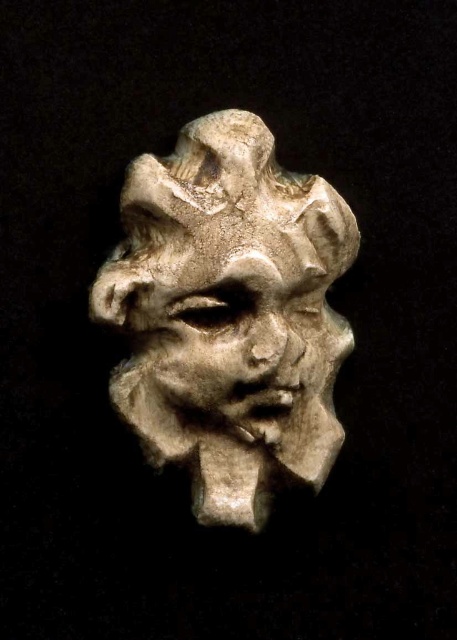
Question: Is matte stone sculpture at center above matte stone face at center?

Choices:
 (A) no
 (B) yes

Answer: (B)

Question: Which of the following is the closest to the observer?

Choices:
 (A) (228, 348)
 (B) (303, 356)

Answer: (A)

Question: Does matte stone sculpture at center appear on the left side of matte stone face at center?

Choices:
 (A) no
 (B) yes

Answer: (B)

Question: Can you confirm if matte stone sculpture at center is thinner than matte stone face at center?

Choices:
 (A) no
 (B) yes

Answer: (A)

Question: Which point is closer to the camera taking this photo?

Choices:
 (A) (304, 264)
 (B) (249, 504)

Answer: (A)